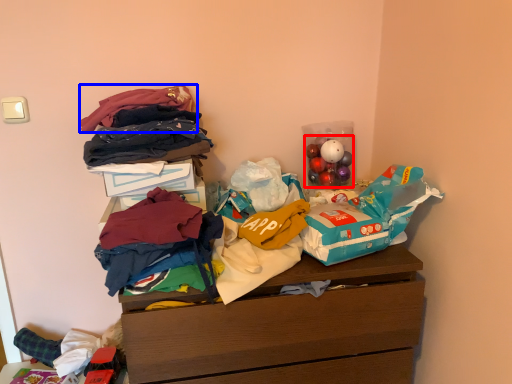
Question: Which of the following is the closest to the observer, toy (highlighted by a red box) or clothing (highlighted by a blue box)?

Choices:
 (A) toy
 (B) clothing

Answer: (B)